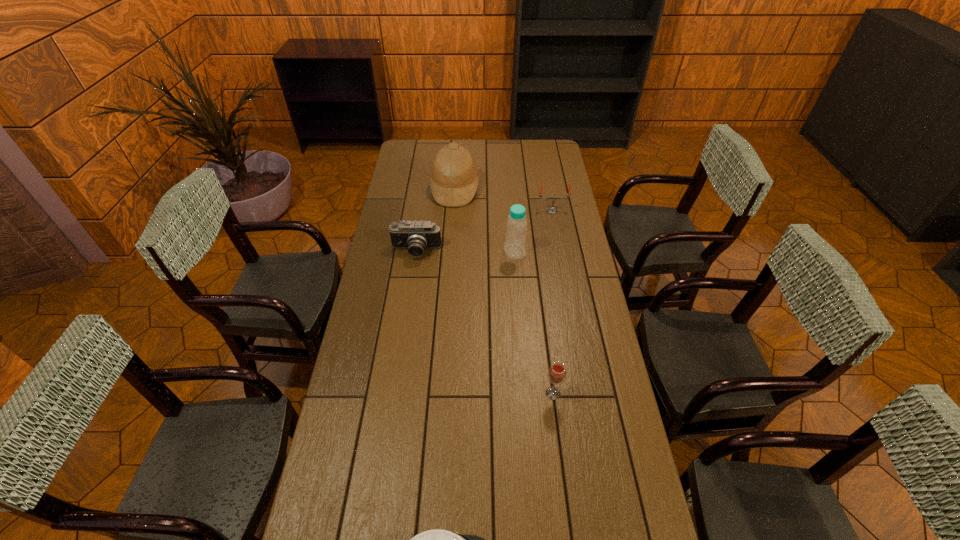
Image resolution: width=960 pixels, height=540 pixels. Identify the location of free space between the rightmost object and the fourth object from left to right. (534, 231).

I want to click on unoccupied area between the camera and the taller hat, so click(436, 221).

This screenshot has width=960, height=540. Find the location of `free point between the taller hat and the camera`. free point between the taller hat and the camera is located at coordinates (436, 221).

Find the location of a particular element. The image size is (960, 540). vacant region between the rightmost object and the fifth object from left to right is located at coordinates (553, 302).

Identify the location of empty location between the camera and the farther hat. The height and width of the screenshot is (540, 960). (x=436, y=221).

Identify the location of object that is the nearest to the bottle. (552, 209).

Locate an element on the screen. object that is the third closest to the candle is located at coordinates [416, 236].

Find the location of `blank space that satisfies the following two spatial constraints: 1. on the front-facing side of the second nearest object; 2. on the left side of the camera`. blank space that satisfies the following two spatial constraints: 1. on the front-facing side of the second nearest object; 2. on the left side of the camera is located at coordinates (396, 393).

In order to click on free spot that satisfies the following two spatial constraints: 1. on the front-facing side of the camera; 2. on the right side of the fifth object from left to right in this screenshot , I will do `click(396, 393)`.

Identify the location of free location that satisfies the following two spatial constraints: 1. on the front-facing side of the bottle; 2. on the left side of the camera. (416, 252).